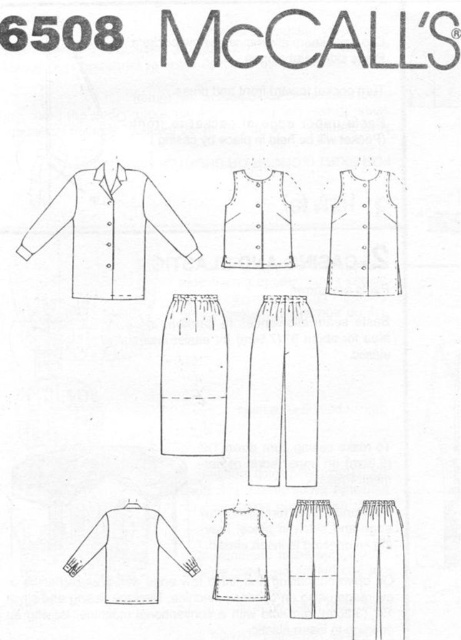
Question: Which object appears farthest from the camera in this image?

Choices:
 (A) matte white vest at upper center
 (B) white cotton shirt at lower left
 (C) white cotton shirt at upper left

Answer: (A)

Question: Among these objects, which one is nearest to the camera?

Choices:
 (A) white cotton shirt at upper left
 (B) matte white vest at center

Answer: (A)

Question: Is matte white vest at upper center above white cotton shirt at lower left?

Choices:
 (A) yes
 (B) no

Answer: (A)

Question: Which point is closer to the camera?

Choices:
 (A) white cotton shirt at upper left
 (B) matte white vest at center

Answer: (A)

Question: In this image, where is white cotton shirt at lower left located relative to matte white vest at center?

Choices:
 (A) below
 (B) above

Answer: (A)

Question: Does matte white vest at upper center lie behind white cotton shirt at lower left?

Choices:
 (A) yes
 (B) no

Answer: (A)